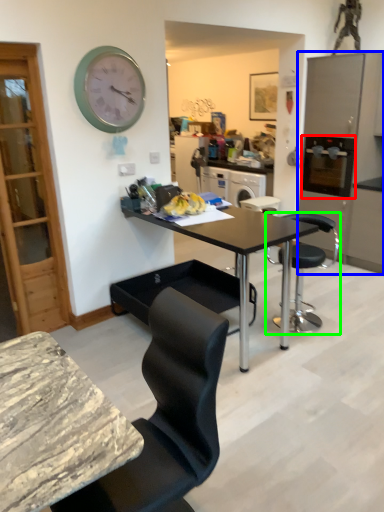
Question: Estimate the real-world distances between objects in this image. Which object is farther from appliance (highlighted by a red box), cabinetry (highlighted by a blue box) or chair (highlighted by a green box)?

Choices:
 (A) cabinetry
 (B) chair

Answer: (B)